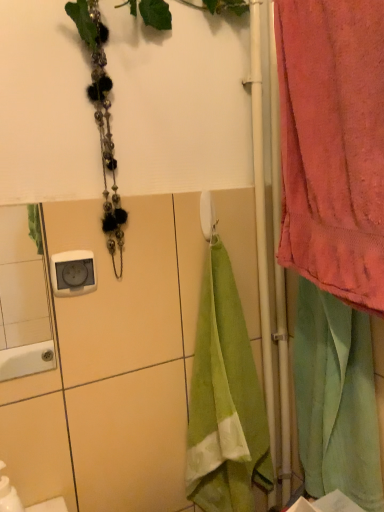
Question: From a real-world perspective, is pink cotton towel at right physically above white plastic towel bar at center?

Choices:
 (A) no
 (B) yes

Answer: (B)

Question: Are pink cotton towel at right and white plastic towel bar at center far apart?

Choices:
 (A) yes
 (B) no

Answer: (B)

Question: Considering the relative sizes of pink cotton towel at right and white plastic towel bar at center in the image provided, is pink cotton towel at right shorter than white plastic towel bar at center?

Choices:
 (A) no
 (B) yes

Answer: (A)

Question: Does pink cotton towel at right lie in front of white plastic towel bar at center?

Choices:
 (A) no
 (B) yes

Answer: (B)

Question: Is white plastic towel bar at center inside pink cotton towel at right?

Choices:
 (A) yes
 (B) no

Answer: (B)

Question: Is white plastic towel bar at center to the left or to the right of pink cotton towel at right in the image?

Choices:
 (A) right
 (B) left

Answer: (B)

Question: In the image, is white plastic towel bar at center positioned in front of or behind pink cotton towel at right?

Choices:
 (A) front
 (B) behind

Answer: (B)

Question: Choose the correct answer: Is white plastic towel bar at center inside pink cotton towel at right or outside it?

Choices:
 (A) inside
 (B) outside

Answer: (B)

Question: From the image's perspective, is white plastic towel bar at center positioned above or below pink cotton towel at right?

Choices:
 (A) above
 (B) below

Answer: (B)

Question: Which is correct: light green velour towel at right is inside white glossy mirror at upper left, or outside of it?

Choices:
 (A) inside
 (B) outside

Answer: (B)

Question: In terms of size, does light green velour towel at right appear bigger or smaller than white glossy mirror at upper left?

Choices:
 (A) big
 (B) small

Answer: (A)

Question: From a real-world perspective, is light green velour towel at right positioned above or below white glossy mirror at upper left?

Choices:
 (A) below
 (B) above

Answer: (A)

Question: Does point (327, 350) appear closer or farther from the camera than point (52, 347)?

Choices:
 (A) closer
 (B) farther

Answer: (B)

Question: Considering the positions of white glossy electric outlet at upper left and white glossy mirror at upper left in the image, is white glossy electric outlet at upper left taller or shorter than white glossy mirror at upper left?

Choices:
 (A) short
 (B) tall

Answer: (A)

Question: Considering their positions, is white glossy electric outlet at upper left located in front of or behind white glossy mirror at upper left?

Choices:
 (A) behind
 (B) front

Answer: (A)